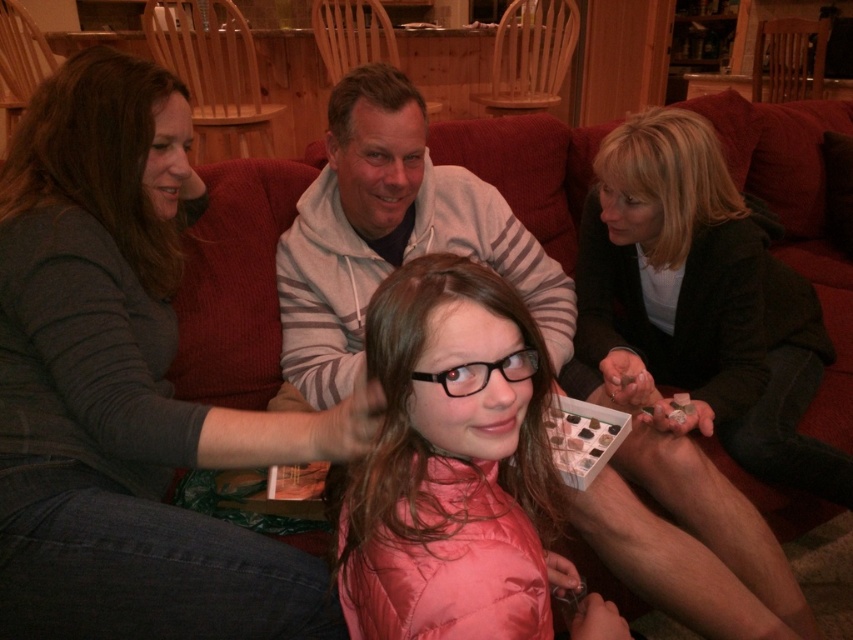
Question: Does gray sweater at upper left have a larger size compared to wooden armchair at upper center?

Choices:
 (A) yes
 (B) no

Answer: (B)

Question: Is gray sweater at upper left smaller than wooden chair at upper center?

Choices:
 (A) yes
 (B) no

Answer: (A)

Question: Which point is farther from the camera taking this photo?

Choices:
 (A) (309, 340)
 (B) (558, 83)

Answer: (B)

Question: Which object is the closest to the pink satin jacket at center?

Choices:
 (A) pink quilted jacket at center
 (B) gray hoodie at center

Answer: (B)

Question: Which point is farther to the camera?

Choices:
 (A) gray sweater at upper left
 (B) gray striped hoodie at center
 (C) pink quilted jacket at center
 (D) wooden armchair at upper center

Answer: (D)

Question: Observing the image, what is the correct spatial positioning of gray sweater at upper left in reference to gray hoodie at center?

Choices:
 (A) left
 (B) right

Answer: (A)